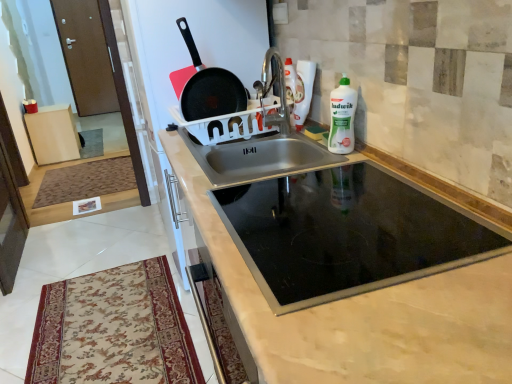
You are a GUI agent. You are given a task and a screenshot of the screen. Output one action in this format:
    pyautogui.click(x=<x>, y=<y>)
    Task: Click on the free spot above black glass cooktop at center (from a real-world perspective)
    
    Given the screenshot: What is the action you would take?
    pyautogui.click(x=364, y=212)